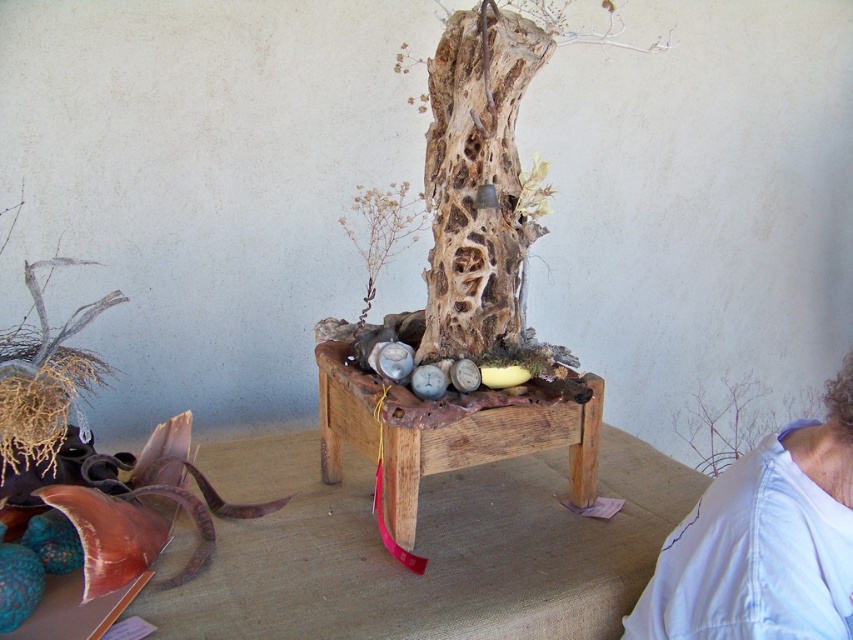
Question: Can you confirm if light blue fabric at upper right is positioned to the right of wooden table at center?

Choices:
 (A) no
 (B) yes

Answer: (B)

Question: Which of these objects is positioned closest to the light blue fabric at upper right?

Choices:
 (A) wooden table at center
 (B) natural wood tree trunk at center

Answer: (A)

Question: From the image, what is the correct spatial relationship of natural wood tree trunk at center in relation to wooden table at center?

Choices:
 (A) left
 (B) right

Answer: (B)

Question: Which point appears farthest from the camera in this image?

Choices:
 (A) (480, 250)
 (B) (462, 428)

Answer: (A)

Question: Which point is farther to the camera?

Choices:
 (A) light blue fabric at upper right
 (B) natural wood tree trunk at center

Answer: (B)

Question: Considering the relative positions of light blue fabric at upper right and wooden table at center in the image provided, where is light blue fabric at upper right located with respect to wooden table at center?

Choices:
 (A) below
 (B) above

Answer: (A)